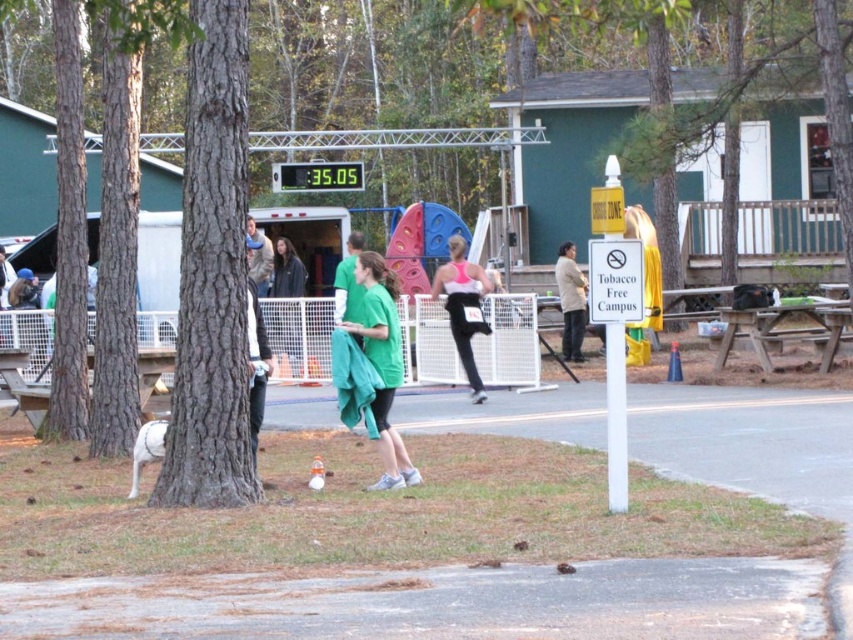
You are a participant in a race and you see the brown rough tree trunk at center and the wooden picnic table at right. Which object is nearer to you as you run past them?

The brown rough tree trunk at center is closer to the viewer than the wooden picnic table at right, so the tree trunk is nearer to you as you run past them.

You are standing at the origin point in the scene. The brown rough tree trunk at center is located at coordinates point 0.433, 0.250. Can you determine its position relative to the digital timer at the top center?

The brown rough tree trunk at center is located at point (212, 276), which is to the right and below the digital timer at the top center since the timer is at the top center of the frame.

You are navigating through the outdoor event area and need to reach a checkpoint located at point (573, 349). There is an obstacle at point (222, 316). Will you encounter the obstacle before reaching the checkpoint?

Yes, you will encounter the obstacle at point (222, 316) before reaching the checkpoint at point (573, 349) because point (222, 316) is in front of point (573, 349).